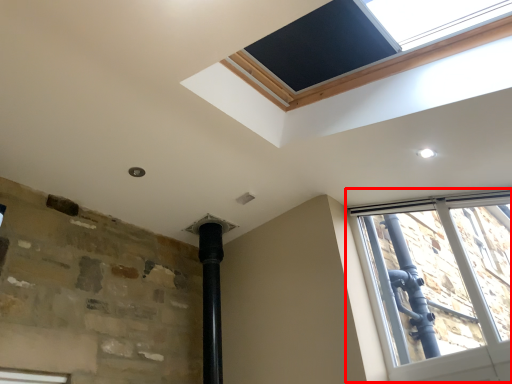
Question: In this image, where is window (annotated by the red box) located relative to window screen?

Choices:
 (A) right
 (B) left

Answer: (A)